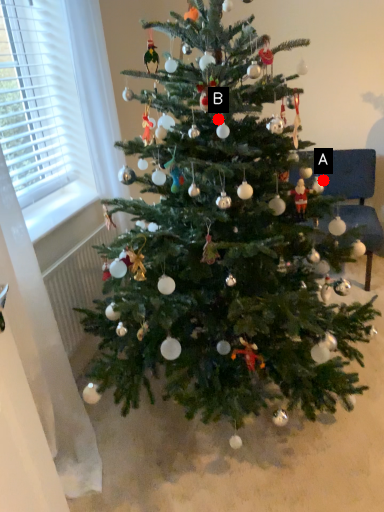
Question: Two points are circled on the image, labeled by A and B beside each circle. Among these points, which one is nearest to the camera?

Choices:
 (A) A is closer
 (B) B is closer

Answer: (B)